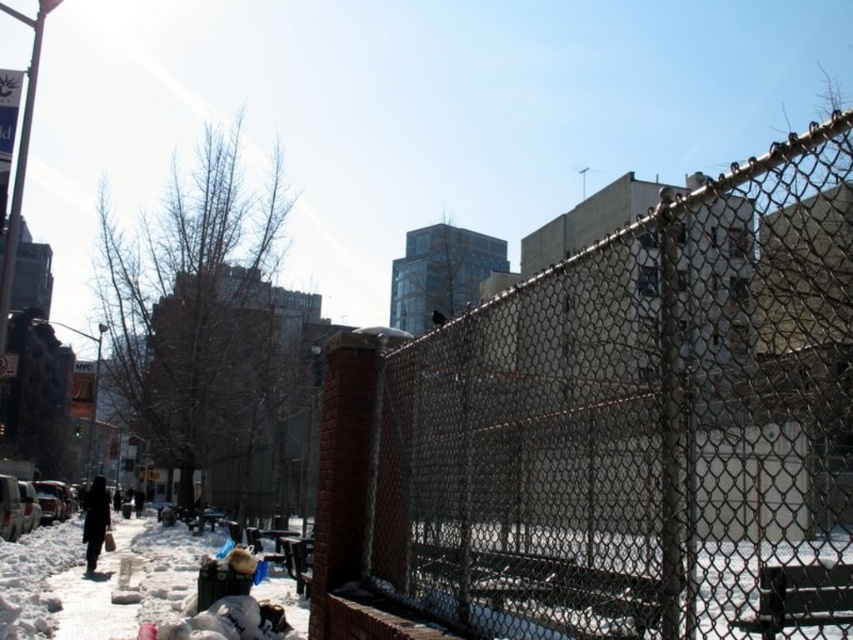
You are a person carrying a large backpack and want to sit on the black metal park bench at center. However, there is a dark brown coat at lower left on the bench. Can you sit there comfortably?

The black metal park bench at center is thinner than the dark brown coat at lower left, which means the bench has less width. Since the coat is taking up space, there might not be enough room for you and your large backpack. It is advisable to find another seating option.

Looking at this image, you are standing at the center of the image and want to walk to the snowy concrete sidewalk at lower left. According to the coordinates given, in which direction should you move?

The snowy concrete sidewalk at lower left is located at coordinates point (96, 580), so you should move downward and to the right to reach it.